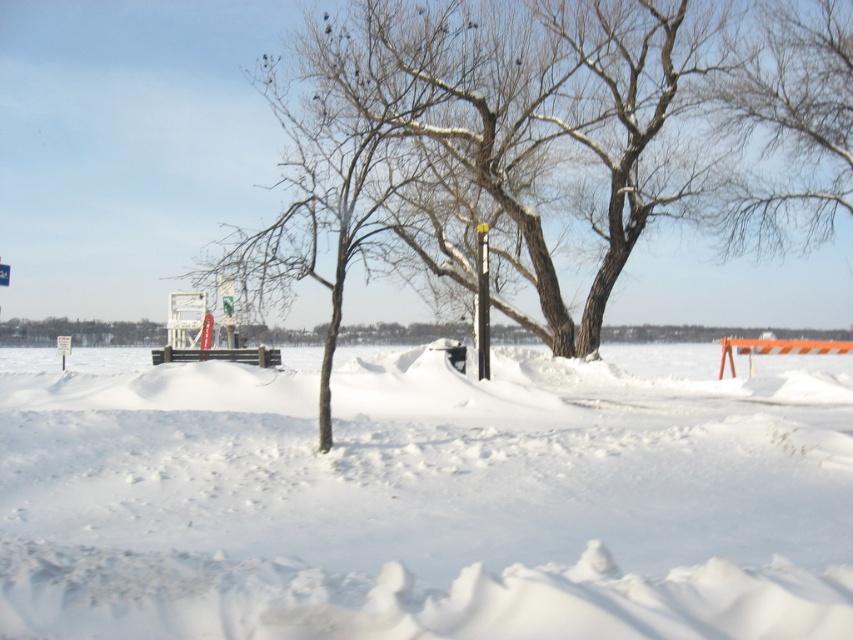
Who is more distant from viewer, (387,394) or (482,250)?

Positioned behind is point (482,250).

The width and height of the screenshot is (853, 640). What are the coordinates of `white fluffy snow at center` in the screenshot? It's located at (425, 497).

This screenshot has width=853, height=640. Identify the location of white fluffy snow at center. (425, 497).

From the picture: Does white plastic sign at center appear over white plastic sign at upper left?

Actually, white plastic sign at center is below white plastic sign at upper left.

Who is taller, white plastic sign at center or white plastic sign at upper left?

With more height is white plastic sign at center.

Is point (62, 353) positioned after point (3, 282)?

Yes, point (62, 353) is behind point (3, 282).

Identify the location of white plastic sign at center. (62, 348).

Is white fluffy snow at center taller than white plastic sign at upper left?

Yes.

Is white fluffy snow at center thinner than white plastic sign at upper left?

Incorrect, white fluffy snow at center's width is not less than white plastic sign at upper left's.

Does point (491, 433) come behind point (4, 280)?

No, it is not.

Identify the location of white fluffy snow at center. The width and height of the screenshot is (853, 640). click(425, 497).